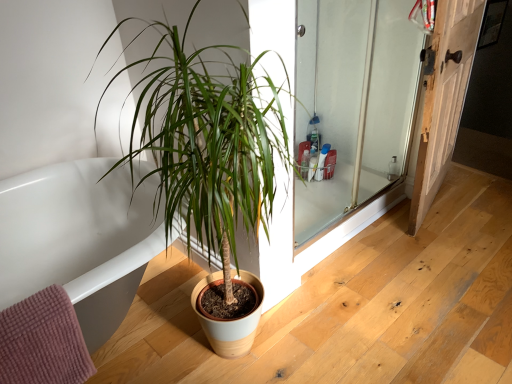
Question: Is white glossy bathtub at lower left turned away from wooden door at right?

Choices:
 (A) no
 (B) yes

Answer: (A)

Question: Can you confirm if white glossy bathtub at lower left is taller than wooden door at right?

Choices:
 (A) yes
 (B) no

Answer: (B)

Question: Is white glossy bathtub at lower left shorter than wooden door at right?

Choices:
 (A) no
 (B) yes

Answer: (B)

Question: Considering the relative sizes of white glossy bathtub at lower left and wooden door at right in the image provided, is white glossy bathtub at lower left thinner than wooden door at right?

Choices:
 (A) no
 (B) yes

Answer: (A)

Question: Can you confirm if white glossy bathtub at lower left is wider than wooden door at right?

Choices:
 (A) yes
 (B) no

Answer: (A)

Question: From the image's perspective, relative to clear glass screen door at right, is green matte plant at center above or below?

Choices:
 (A) above
 (B) below

Answer: (B)

Question: In terms of height, does green matte plant at center look taller or shorter compared to clear glass screen door at right?

Choices:
 (A) tall
 (B) short

Answer: (A)

Question: Is green matte plant at center in front of or behind clear glass screen door at right in the image?

Choices:
 (A) front
 (B) behind

Answer: (A)

Question: Would you say green matte plant at center is to the left or to the right of clear glass screen door at right in the picture?

Choices:
 (A) right
 (B) left

Answer: (B)

Question: From the image's perspective, is clear glass screen door at right located above or below white glossy bathtub at lower left?

Choices:
 (A) below
 (B) above

Answer: (B)

Question: From a real-world perspective, is clear glass screen door at right positioned above or below white glossy bathtub at lower left?

Choices:
 (A) above
 (B) below

Answer: (A)

Question: Choose the correct answer: Is clear glass screen door at right inside white glossy bathtub at lower left or outside it?

Choices:
 (A) inside
 (B) outside

Answer: (B)

Question: In terms of width, does clear glass screen door at right look wider or thinner when compared to white glossy bathtub at lower left?

Choices:
 (A) wide
 (B) thin

Answer: (B)

Question: Considering the relative positions of white glossy bathtub at lower left and wooden door at right in the image provided, is white glossy bathtub at lower left to the left or to the right of wooden door at right?

Choices:
 (A) left
 (B) right

Answer: (A)

Question: Is white glossy bathtub at lower left in front of or behind wooden door at right in the image?

Choices:
 (A) front
 (B) behind

Answer: (A)